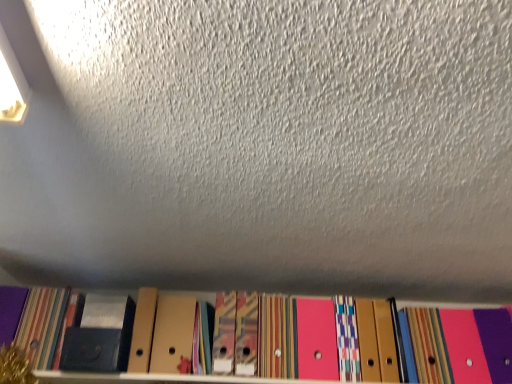
Question: Does matte black paperback book at lower left, which is the first paperback book from right to left, have a larger size compared to cardboard folders at lower center?

Choices:
 (A) yes
 (B) no

Answer: (B)

Question: Would you say matte black paperback book at lower left, which is the first paperback book from right to left, is outside cardboard folders at lower center?

Choices:
 (A) yes
 (B) no

Answer: (A)

Question: Considering the relative sizes of matte black paperback book at lower left, the second paperback book positioned from the left, and cardboard folders at lower center in the image provided, is matte black paperback book at lower left, the second paperback book positioned from the left, thinner than cardboard folders at lower center?

Choices:
 (A) no
 (B) yes

Answer: (B)

Question: Is matte black paperback book at lower left, the second paperback book positioned from the left, facing away from cardboard folders at lower center?

Choices:
 (A) yes
 (B) no

Answer: (B)

Question: Is matte black paperback book at lower left, which is the first paperback book from right to left, not near cardboard folders at lower center?

Choices:
 (A) yes
 (B) no

Answer: (B)

Question: From a real-world perspective, is matte black paperback book at lower left, which is the first paperback book from right to left, located higher than cardboard folders at lower center?

Choices:
 (A) no
 (B) yes

Answer: (B)

Question: Is matte black paperback book at lower left, which appears as the 1th paperback book when viewed from the left, aimed at cardboard folders at lower center?

Choices:
 (A) yes
 (B) no

Answer: (B)

Question: Considering the relative sizes of matte black paperback book at lower left, which appears as the 1th paperback book when viewed from the left, and cardboard folders at lower center in the image provided, is matte black paperback book at lower left, which appears as the 1th paperback book when viewed from the left, thinner than cardboard folders at lower center?

Choices:
 (A) no
 (B) yes

Answer: (B)

Question: Is matte black paperback book at lower left, the second paperback book when ordered from right to left, positioned with its back to cardboard folders at lower center?

Choices:
 (A) no
 (B) yes

Answer: (A)

Question: Considering the relative sizes of matte black paperback book at lower left, which appears as the 1th paperback book when viewed from the left, and cardboard folders at lower center in the image provided, is matte black paperback book at lower left, which appears as the 1th paperback book when viewed from the left, wider than cardboard folders at lower center?

Choices:
 (A) no
 (B) yes

Answer: (A)

Question: From the image's perspective, is matte black paperback book at lower left, which appears as the 1th paperback book when viewed from the left, located beneath cardboard folders at lower center?

Choices:
 (A) yes
 (B) no

Answer: (A)

Question: Is matte black paperback book at lower left, which appears as the 1th paperback book when viewed from the left, not within cardboard folders at lower center?

Choices:
 (A) no
 (B) yes

Answer: (B)

Question: Does matte black paperback book at lower left, which appears as the 1th paperback book when viewed from the left, have a lesser height compared to matte black paperback book at lower left, which is the first paperback book from right to left?

Choices:
 (A) yes
 (B) no

Answer: (B)